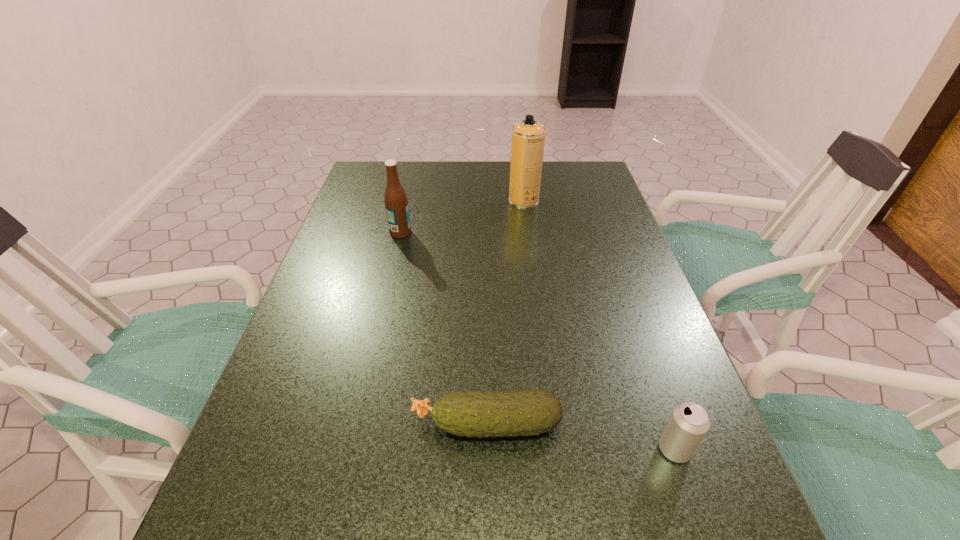
The image size is (960, 540). Identify the location of aerosol can. (528, 136).

You are a GUI agent. You are given a task and a screenshot of the screen. Output one action in this format:
    pyautogui.click(x=<x>, y=<y>)
    Task: Click on the farthest object
    This screenshot has height=540, width=960.
    Given the screenshot: What is the action you would take?
    pyautogui.click(x=528, y=136)

At what (x,y) coordinates should I click in order to perform the action: click on the second tallest object. Please return your answer as a coordinate pair (x, y). Image resolution: width=960 pixels, height=540 pixels. Looking at the image, I should click on (396, 204).

Identify the location of the leftmost object. (396, 204).

Identify the location of beer can. (688, 424).

Locate an element on the screen. Image resolution: width=960 pixels, height=540 pixels. the third tallest object is located at coordinates (688, 424).

Identify the location of the shortest object. (523, 412).

Locate an element on the screen. The image size is (960, 540). vacant area situated 0.300m on the left of the farthest object is located at coordinates 414,200.

You are a GUI agent. You are given a task and a screenshot of the screen. Output one action in this format:
    pyautogui.click(x=<x>, y=<y>)
    Task: Click on the vacant area situated on the back of the second farthest object
    The height and width of the screenshot is (540, 960).
    Given the screenshot: What is the action you would take?
    pyautogui.click(x=416, y=168)

What are the coordinates of `vacant space located on the left of the beer can` in the screenshot? It's located at (612, 449).